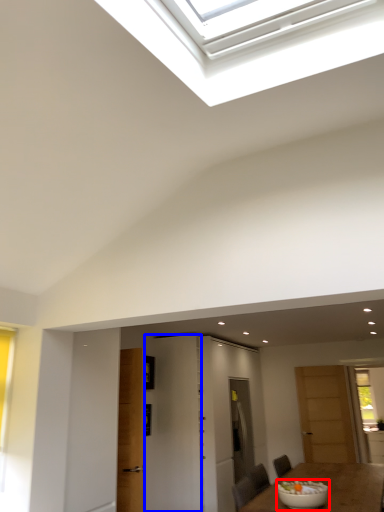
Question: Among these objects, which one is farthest to the camera, bowl (highlighted by a red box) or door (highlighted by a blue box)?

Choices:
 (A) bowl
 (B) door

Answer: (B)